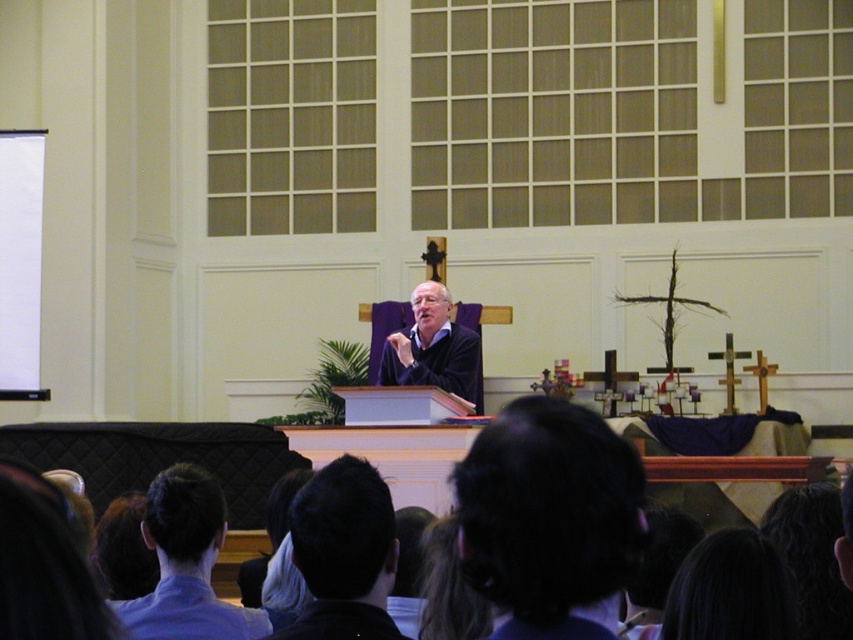
You are standing at the camera position and want to hand a note to the man in the blue shirt at lower left. Can you reach him without moving from your current position?

The blue shirt at lower left is 9.53 meters away from camera, so you cannot reach him without moving from your current position.

In the church scene, there are two individuals with dark brown hair at lower center and dark brown hair at center. Which one is taller?

The dark brown hair at lower center is much taller than the dark brown hair at center.